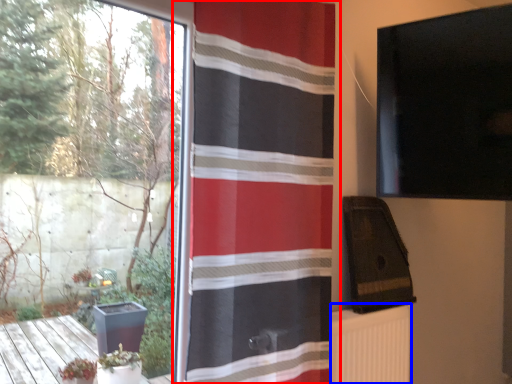
Question: Which point is closer to the camera, curtain (highlighted by a red box) or radiator (highlighted by a blue box)?

Choices:
 (A) curtain
 (B) radiator

Answer: (A)